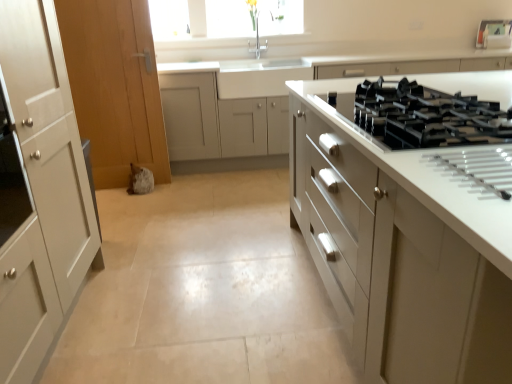
Image resolution: width=512 pixels, height=384 pixels. Identify the location of black glass gas stove at right. click(x=426, y=116).

Consider the image. Considering the sizes of objects white glossy cabinetry at center, the first cabinetry in the back-to-front sequence, and white glossy cabinet at right, the second cabinetry viewed from the back, in the image provided, who is thinner, white glossy cabinetry at center, the first cabinetry in the back-to-front sequence, or white glossy cabinet at right, the second cabinetry viewed from the back,?

Thinner between the two is white glossy cabinetry at center, the first cabinetry in the back-to-front sequence.

How much distance is there between white glossy cabinetry at center, which is the second cabinetry in front-to-back order, and white glossy cabinet at right, the second cabinetry viewed from the back?

white glossy cabinetry at center, which is the second cabinetry in front-to-back order, and white glossy cabinet at right, the second cabinetry viewed from the back, are 6.55 feet apart.

From their relative heights in the image, would you say white glossy cabinetry at center, the first cabinetry in the back-to-front sequence, is taller or shorter than white glossy cabinet at right, the second cabinetry viewed from the back?

In the image, white glossy cabinetry at center, the first cabinetry in the back-to-front sequence, appears to be taller than white glossy cabinet at right, the second cabinetry viewed from the back.

Looking at this image, based on their sizes in the image, would you say white glossy cabinetry at center, the first cabinetry in the back-to-front sequence, is bigger or smaller than white glossy cabinet at right, the second cabinetry viewed from the back?

Considering their sizes, white glossy cabinetry at center, the first cabinetry in the back-to-front sequence, takes up less space than white glossy cabinet at right, the second cabinetry viewed from the back.

From the image's perspective, would you say white glossy cabinet at right, the second cabinetry viewed from the back, is shown under white glossy cabinetry at center, which is the second cabinetry in front-to-back order?

Correct, white glossy cabinet at right, the second cabinetry viewed from the back, appears lower than white glossy cabinetry at center, which is the second cabinetry in front-to-back order, in the image.

Find the location of a particular element. The image size is (512, 384). cabinetry below the white glossy cabinetry at center, which is the second cabinetry in front-to-back order (from the image's perspective) is located at coordinates (405, 241).

Consider the image. Is white glossy cabinetry at center, the first cabinetry in the back-to-front sequence, surrounded by white glossy cabinet at right, the first cabinetry viewed from the front?

Definitely not — white glossy cabinetry at center, the first cabinetry in the back-to-front sequence, is not inside white glossy cabinet at right, the first cabinetry viewed from the front.

Is white glossy cabinet at right, the second cabinetry viewed from the back, wider than white glossy cabinetry at center, which is the second cabinetry in front-to-back order?

Correct, the width of white glossy cabinet at right, the second cabinetry viewed from the back, exceeds that of white glossy cabinetry at center, which is the second cabinetry in front-to-back order.

Find the location of a particular element. gas stove that appears behind the white glossy cabinet at right, the first cabinetry viewed from the front is located at coordinates (426, 116).

Is black glass gas stove at right facing towards white glossy cabinet at right, the second cabinetry viewed from the back?

No, black glass gas stove at right is not turned towards white glossy cabinet at right, the second cabinetry viewed from the back.

Is black glass gas stove at right directly adjacent to white glossy cabinet at right, the second cabinetry viewed from the back?

No, black glass gas stove at right is not making contact with white glossy cabinet at right, the second cabinetry viewed from the back.

Between black glass gas stove at right and white glossy cabinet at right, the first cabinetry viewed from the front, which one has less height?

black glass gas stove at right is shorter.

From the image's perspective, which one is positioned lower, white glossy cabinetry at center, which is the second cabinetry in front-to-back order, or black glass gas stove at right?

black glass gas stove at right is shown below in the image.

Considering the relative sizes of white glossy cabinetry at center, the first cabinetry in the back-to-front sequence, and black glass gas stove at right in the image provided, is white glossy cabinetry at center, the first cabinetry in the back-to-front sequence, smaller than black glass gas stove at right?

Actually, white glossy cabinetry at center, the first cabinetry in the back-to-front sequence, might be larger than black glass gas stove at right.

Considering the sizes of white glossy cabinetry at center, which is the second cabinetry in front-to-back order, and black glass gas stove at right in the image, is white glossy cabinetry at center, which is the second cabinetry in front-to-back order, taller or shorter than black glass gas stove at right?

In the image, white glossy cabinetry at center, which is the second cabinetry in front-to-back order, appears to be taller than black glass gas stove at right.

In the scene shown: In the image, is white glossy cabinetry at center, which is the second cabinetry in front-to-back order, positioned in front of or behind black glass gas stove at right?

white glossy cabinetry at center, which is the second cabinetry in front-to-back order, is positioned farther from the viewer than black glass gas stove at right.

Considering the relative positions of white glossy cabinet at right, the second cabinetry viewed from the back, and black glass gas stove at right in the image provided, is white glossy cabinet at right, the second cabinetry viewed from the back, to the right of black glass gas stove at right from the viewer's perspective?

Correct, you'll find white glossy cabinet at right, the second cabinetry viewed from the back, to the right of black glass gas stove at right.

Is white glossy cabinet at right, the second cabinetry viewed from the back, facing away from black glass gas stove at right?

No, white glossy cabinet at right, the second cabinetry viewed from the back, is not facing the opposite direction of black glass gas stove at right.

Is white glossy cabinet at right, the second cabinetry viewed from the back, not inside black glass gas stove at right?

white glossy cabinet at right, the second cabinetry viewed from the back, lies outside black glass gas stove at right's area.

Does point (373, 119) come behind point (247, 91)?

That is False.

Considering the positions of objects black glass gas stove at right and white glossy cabinetry at center, which is the second cabinetry in front-to-back order, in the image provided, who is behind, black glass gas stove at right or white glossy cabinetry at center, which is the second cabinetry in front-to-back order,?

white glossy cabinetry at center, which is the second cabinetry in front-to-back order, is further from the camera.

Is black glass gas stove at right shorter than white glossy cabinetry at center, which is the second cabinetry in front-to-back order?

Yes.

Locate an element on the screen. This screenshot has height=384, width=512. cabinetry in front of the white glossy cabinetry at center, which is the second cabinetry in front-to-back order is located at coordinates pos(405,241).

Locate an element on the screen. cabinetry located behind the white glossy cabinet at right, the second cabinetry viewed from the back is located at coordinates (277, 89).

Based on their spatial positions, is white glossy cabinet at right, the second cabinetry viewed from the back, or white glossy cabinetry at center, which is the second cabinetry in front-to-back order, further from black glass gas stove at right?

white glossy cabinetry at center, which is the second cabinetry in front-to-back order, is positioned further to the anchor black glass gas stove at right.

From the image, which object appears to be farther from white glossy cabinet at right, the first cabinetry viewed from the front, black glass gas stove at right or white glossy cabinetry at center, which is the second cabinetry in front-to-back order?

The object further to white glossy cabinet at right, the first cabinetry viewed from the front, is white glossy cabinetry at center, which is the second cabinetry in front-to-back order.

Looking at this image, when comparing their distances from white glossy cabinetry at center, the first cabinetry in the back-to-front sequence, does black glass gas stove at right or white glossy cabinet at right, the first cabinetry viewed from the front, seem closer?

Among the two, white glossy cabinet at right, the first cabinetry viewed from the front, is located nearer to white glossy cabinetry at center, the first cabinetry in the back-to-front sequence.

Which object lies further to the anchor point white glossy cabinet at right, the first cabinetry viewed from the front, white glossy cabinetry at center, which is the second cabinetry in front-to-back order, or black glass gas stove at right?

white glossy cabinetry at center, which is the second cabinetry in front-to-back order, lies further to white glossy cabinet at right, the first cabinetry viewed from the front, than the other object.

When comparing their distances from black glass gas stove at right, does white glossy cabinetry at center, the first cabinetry in the back-to-front sequence, or white glossy cabinet at right, the second cabinetry viewed from the back, seem closer?

white glossy cabinet at right, the second cabinetry viewed from the back, is positioned closer to the anchor black glass gas stove at right.

Considering their positions, is white glossy cabinet at right, the second cabinetry viewed from the back, positioned closer to white glossy cabinetry at center, which is the second cabinetry in front-to-back order, than black glass gas stove at right?

white glossy cabinet at right, the second cabinetry viewed from the back.

Where is `gas stove between white glossy cabinet at right, the second cabinetry viewed from the back, and white glossy cabinetry at center, which is the second cabinetry in front-to-back order, from front to back`? The width and height of the screenshot is (512, 384). gas stove between white glossy cabinet at right, the second cabinetry viewed from the back, and white glossy cabinetry at center, which is the second cabinetry in front-to-back order, from front to back is located at coordinates (426, 116).